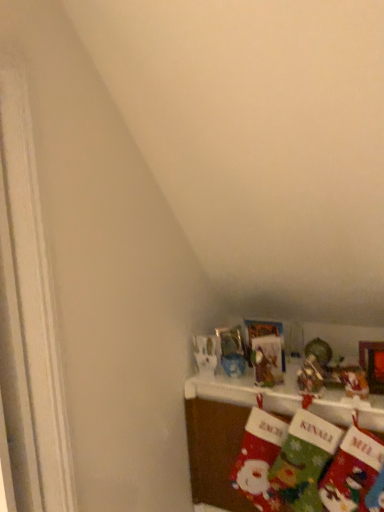
Question: Is red felt stocking at lower right, acting as the 3th sock starting from the right, to the left of shiny metallic ornament at upper right, which is the 1th toy from right to left, from the viewer's perspective?

Choices:
 (A) no
 (B) yes

Answer: (B)

Question: Does red felt stocking at lower right, acting as the 3th sock starting from the right, have a greater width compared to shiny metallic ornament at upper right, which is the 1th toy from right to left?

Choices:
 (A) yes
 (B) no

Answer: (A)

Question: Can we say red felt stocking at lower right, acting as the 3th sock starting from the right, lies outside shiny metallic ornament at upper right, the 2th toy in the left-to-right sequence?

Choices:
 (A) yes
 (B) no

Answer: (A)

Question: Considering the relative sizes of red felt stocking at lower right, acting as the 1th sock starting from the left, and shiny metallic ornament at upper right, which is the 1th toy from right to left, in the image provided, is red felt stocking at lower right, acting as the 1th sock starting from the left, thinner than shiny metallic ornament at upper right, which is the 1th toy from right to left,?

Choices:
 (A) yes
 (B) no

Answer: (B)

Question: Considering the relative sizes of red felt stocking at lower right, acting as the 1th sock starting from the left, and shiny metallic ornament at upper right, the 2th toy in the left-to-right sequence, in the image provided, is red felt stocking at lower right, acting as the 1th sock starting from the left, bigger than shiny metallic ornament at upper right, the 2th toy in the left-to-right sequence,?

Choices:
 (A) no
 (B) yes

Answer: (B)

Question: Do you think velvet christmas stockings at lower right is within red felt stocking at lower right, acting as the 1th sock starting from the left, or outside of it?

Choices:
 (A) outside
 (B) inside

Answer: (A)

Question: Does point (208, 387) appear closer or farther from the camera than point (251, 490)?

Choices:
 (A) closer
 (B) farther

Answer: (B)

Question: From the image's perspective, relative to red felt stocking at lower right, acting as the 1th sock starting from the left, is velvet christmas stockings at lower right above or below?

Choices:
 (A) below
 (B) above

Answer: (A)

Question: Relative to red felt stocking at lower right, acting as the 3th sock starting from the right, is velvet christmas stockings at lower right in front or behind?

Choices:
 (A) behind
 (B) front

Answer: (B)

Question: Would you say green felt stocking at lower right, placed as the 3th sock when sorted from left to right, is to the left or to the right of velvet christmas stockings at lower right in the picture?

Choices:
 (A) left
 (B) right

Answer: (B)

Question: From a real-world perspective, relative to velvet christmas stockings at lower right, is green felt stocking at lower right, placed as the 3th sock when sorted from left to right, vertically above or below?

Choices:
 (A) below
 (B) above

Answer: (B)

Question: Considering the positions of point (360, 483) and point (240, 422), is point (360, 483) closer or farther from the camera than point (240, 422)?

Choices:
 (A) farther
 (B) closer

Answer: (B)

Question: Is green felt stocking at lower right, the first sock in the right-to-left sequence, inside the boundaries of velvet christmas stockings at lower right, or outside?

Choices:
 (A) outside
 (B) inside

Answer: (B)

Question: From the image's perspective, is shiny metallic ornament at upper right, the 2th toy in the left-to-right sequence, positioned above or below velvet christmas stockings at lower right?

Choices:
 (A) above
 (B) below

Answer: (A)

Question: From a real-world perspective, is shiny metallic ornament at upper right, which is the 1th toy from right to left, positioned above or below velvet christmas stockings at lower right?

Choices:
 (A) below
 (B) above

Answer: (B)